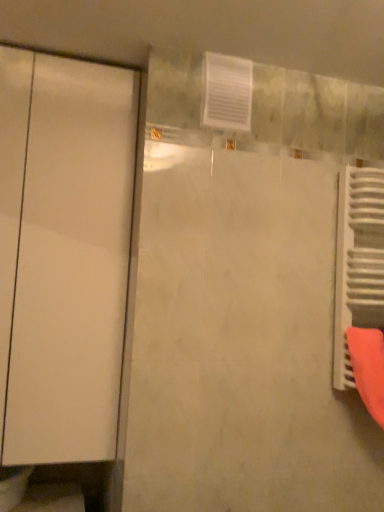
Question: Is white metallic radiator at right at the right side of white glossy door at left?

Choices:
 (A) no
 (B) yes

Answer: (B)

Question: Can you confirm if white metallic radiator at right is wider than white glossy door at left?

Choices:
 (A) no
 (B) yes

Answer: (A)

Question: From the image's perspective, is white metallic radiator at right on top of white glossy door at left?

Choices:
 (A) yes
 (B) no

Answer: (B)

Question: Is white metallic radiator at right smaller than white glossy door at left?

Choices:
 (A) no
 (B) yes

Answer: (B)

Question: Is white metallic radiator at right positioned in front of white glossy door at left?

Choices:
 (A) no
 (B) yes

Answer: (A)

Question: Is white metallic radiator at right positioned with its back to white glossy door at left?

Choices:
 (A) yes
 (B) no

Answer: (B)

Question: Would you consider white glossy door at left to be distant from white metallic radiator at right?

Choices:
 (A) yes
 (B) no

Answer: (B)

Question: Can you confirm if white glossy door at left is positioned to the left of white metallic radiator at right?

Choices:
 (A) yes
 (B) no

Answer: (A)

Question: From a real-world perspective, is white glossy door at left physically below white metallic radiator at right?

Choices:
 (A) no
 (B) yes

Answer: (A)

Question: Would you say white glossy door at left is outside white metallic radiator at right?

Choices:
 (A) no
 (B) yes

Answer: (B)

Question: Could you tell me if white glossy door at left is facing white metallic radiator at right?

Choices:
 (A) no
 (B) yes

Answer: (A)

Question: Is white glossy door at left thinner than white metallic radiator at right?

Choices:
 (A) no
 (B) yes

Answer: (A)

Question: Considering the positions of white glossy door at left and white metallic radiator at right in the image, is white glossy door at left wider or thinner than white metallic radiator at right?

Choices:
 (A) wide
 (B) thin

Answer: (A)